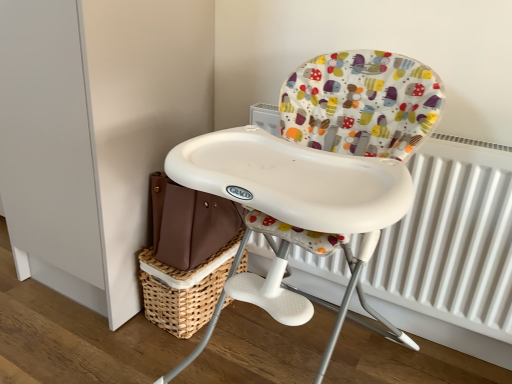
Question: Is the position of woven brown basket at lower center more distant than that of white plastic highchair at center?

Choices:
 (A) no
 (B) yes

Answer: (B)

Question: From the image's perspective, is woven brown basket at lower center on top of white plastic highchair at center?

Choices:
 (A) no
 (B) yes

Answer: (A)

Question: Is woven brown basket at lower center wider than white plastic highchair at center?

Choices:
 (A) no
 (B) yes

Answer: (A)

Question: Is woven brown basket at lower center positioned before white plastic highchair at center?

Choices:
 (A) no
 (B) yes

Answer: (A)

Question: Would you say white plastic highchair at center is part of woven brown basket at lower center's contents?

Choices:
 (A) yes
 (B) no

Answer: (B)

Question: From the image's perspective, does woven brown basket at lower center appear lower than white plastic highchair at center?

Choices:
 (A) yes
 (B) no

Answer: (A)

Question: Can you confirm if white metallic radiator at right is thinner than woven brown basket at lower center?

Choices:
 (A) yes
 (B) no

Answer: (A)

Question: Is white metallic radiator at right positioned before woven brown basket at lower center?

Choices:
 (A) no
 (B) yes

Answer: (B)

Question: From a real-world perspective, is white metallic radiator at right positioned over woven brown basket at lower center based on gravity?

Choices:
 (A) yes
 (B) no

Answer: (A)

Question: Is white metallic radiator at right turned away from woven brown basket at lower center?

Choices:
 (A) no
 (B) yes

Answer: (A)

Question: Could you tell me if white metallic radiator at right is turned towards woven brown basket at lower center?

Choices:
 (A) yes
 (B) no

Answer: (B)

Question: Considering the relative sizes of white metallic radiator at right and woven brown basket at lower center in the image provided, is white metallic radiator at right shorter than woven brown basket at lower center?

Choices:
 (A) no
 (B) yes

Answer: (A)

Question: From the image's perspective, is white plastic highchair at center on top of woven brown basket at lower center?

Choices:
 (A) no
 (B) yes

Answer: (B)